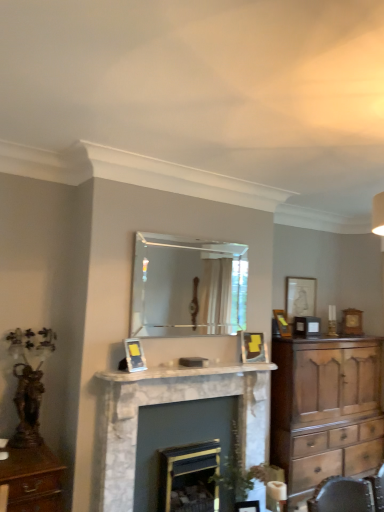
Question: Is matte gold picture frame at center, positioned as the 4th picture frame in back-to-front order, oriented towards white marble fireplace mantel at center?

Choices:
 (A) no
 (B) yes

Answer: (A)

Question: Is matte gold picture frame at center, positioned as the 4th picture frame in back-to-front order, beside white marble fireplace mantel at center?

Choices:
 (A) no
 (B) yes

Answer: (A)

Question: Considering the relative positions of matte gold picture frame at center, the 1th picture frame viewed from the left, and white marble fireplace mantel at center in the image provided, is matte gold picture frame at center, the 1th picture frame viewed from the left, in front of white marble fireplace mantel at center?

Choices:
 (A) no
 (B) yes

Answer: (A)

Question: From the image's perspective, is matte gold picture frame at center, the fourth picture frame in the right-to-left sequence, on top of white marble fireplace mantel at center?

Choices:
 (A) no
 (B) yes

Answer: (B)

Question: Is matte gold picture frame at center, the fourth picture frame in the right-to-left sequence, thinner than white marble fireplace mantel at center?

Choices:
 (A) no
 (B) yes

Answer: (B)

Question: Is wooden chest of drawers at right closer to the viewer compared to dark gray marble fireplace at center, which appears as the first fireplace when viewed from the right?

Choices:
 (A) no
 (B) yes

Answer: (A)

Question: Can you confirm if wooden chest of drawers at right is wider than dark gray marble fireplace at center, arranged as the 2th fireplace when viewed from the left?

Choices:
 (A) no
 (B) yes

Answer: (B)

Question: Is wooden chest of drawers at right far away from dark gray marble fireplace at center, which appears as the first fireplace when viewed from the right?

Choices:
 (A) yes
 (B) no

Answer: (A)

Question: From a real-world perspective, does wooden chest of drawers at right sit lower than dark gray marble fireplace at center, which appears as the first fireplace when viewed from the right?

Choices:
 (A) no
 (B) yes

Answer: (A)

Question: From a real-world perspective, does wooden chest of drawers at right stand above dark gray marble fireplace at center, which appears as the first fireplace when viewed from the right?

Choices:
 (A) no
 (B) yes

Answer: (B)

Question: Is wooden chest of drawers at right next to dark gray marble fireplace at center, which appears as the first fireplace when viewed from the right?

Choices:
 (A) no
 (B) yes

Answer: (A)

Question: Is the depth of white marble fireplace mantel at center less than that of marble fireplace at center, acting as the 1th fireplace starting from the left?

Choices:
 (A) no
 (B) yes

Answer: (A)